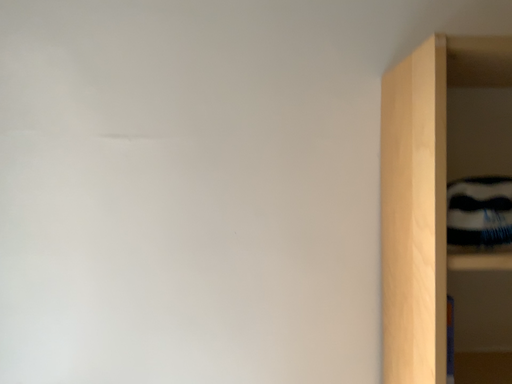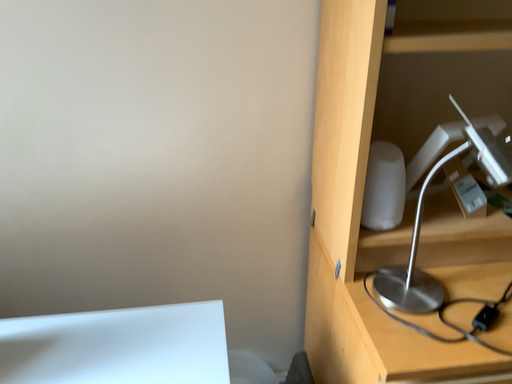
Question: Which way did the camera rotate in the video?

Choices:
 (A) rotated upward
 (B) rotated downward

Answer: (B)